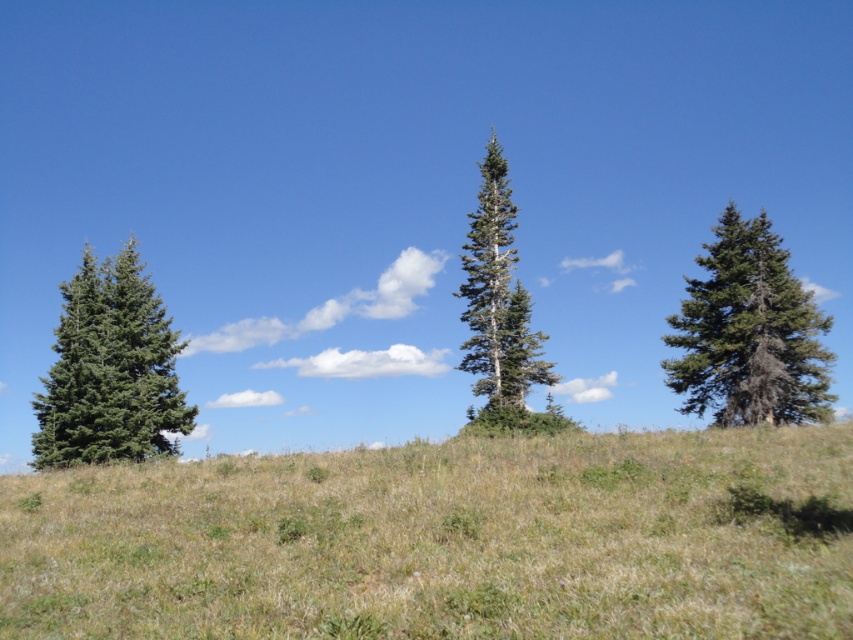
Image resolution: width=853 pixels, height=640 pixels. What are the coordinates of `green matte tree at right` in the screenshot? It's located at (749, 332).

Does point (733, 232) come closer to viewer compared to point (549, 428)?

No, (733, 232) is behind (549, 428).

Between point (677, 337) and point (495, 289), which one is positioned in front?

Point (677, 337) is more forward.

This screenshot has width=853, height=640. I want to click on green matte tree at right, so click(x=749, y=332).

How much distance is there between green grassy hillside at center and green matte tree at right?

green grassy hillside at center and green matte tree at right are 15.75 meters apart from each other.

Does green grassy hillside at center have a larger size compared to green matte tree at right?

No, green grassy hillside at center is not bigger than green matte tree at right.

Identify the location of green grassy hillside at center. (437, 541).

Between green matte tree at right and green matte tree at left, which one is positioned higher?

green matte tree at right is above.

Who is more forward, (701,289) or (144,378)?

Point (701,289) is more forward.

The width and height of the screenshot is (853, 640). Find the location of `green matte tree at right`. green matte tree at right is located at coordinates (749, 332).